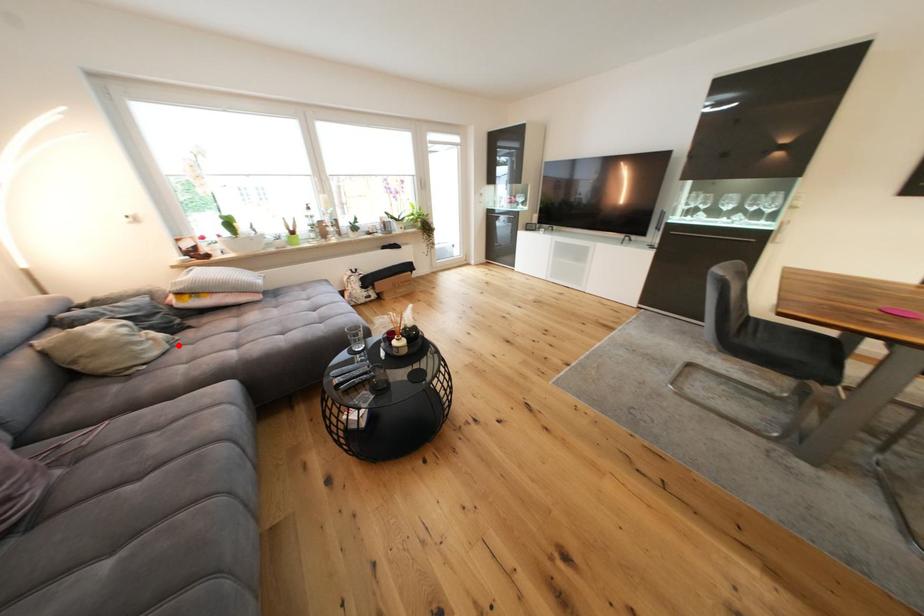
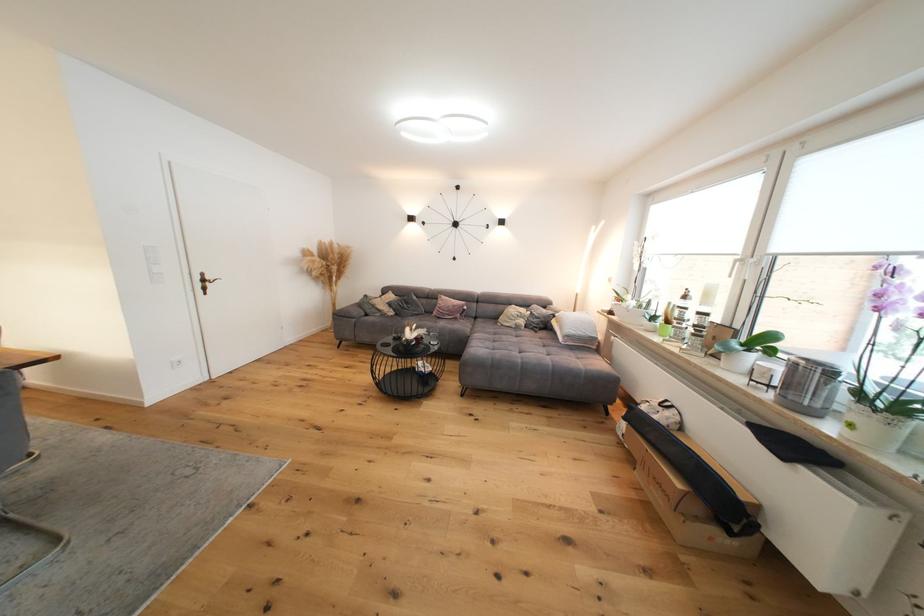
Question: A red point is marked in image1. In image2, is the corresponding 3D point closer to the camera or farther? Reply with the corresponding letter.

Choices:
 (A) The corresponding 3D point is closer.
 (B) The corresponding 3D point is farther.

Answer: (B)